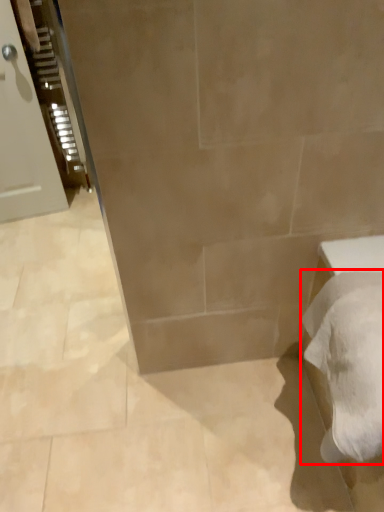
Question: From the image's perspective, what is the correct spatial relationship of bath towel (annotated by the red box) in relation to door?

Choices:
 (A) above
 (B) below

Answer: (B)